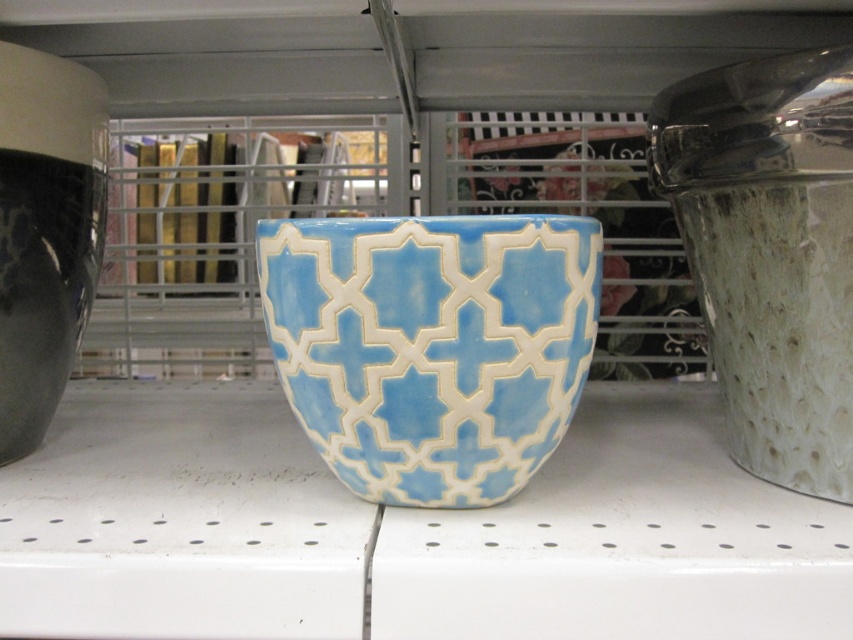
You are a customer in a store looking at the light blue glazed bowl at center and the matte black vase at left. Which item is positioned to the left side of the other?

The matte black vase at left is positioned to the left side of the light blue glazed bowl at center.

You are a store employee arranging items on a shelf. You have a textured glass jar at right and a matte black vase at left. The shelf is 24 inches wide. Can you fit another small item between them without moving the existing items?

The distance between the textured glass jar at right and the matte black vase at left is 20.54 inches. Since the shelf is 24 inches wide, there is 3.46 inches of space remaining. This space may be insufficient for a small item depending on its size, but technically there is some room available.